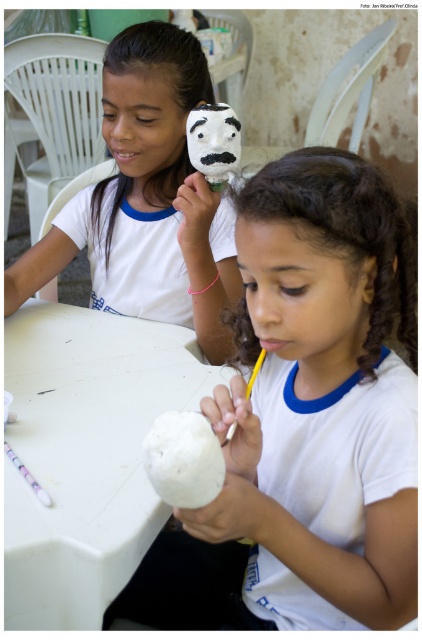
Question: Which object is the closest to the white matte mask at upper center?

Choices:
 (A) white matte egg at center
 (B) white plastic table at center
 (C) white plush toy at upper center
 (D) white matte coconut at center

Answer: (C)

Question: Is white matte mask at upper center below yellow matte pencil at center?

Choices:
 (A) no
 (B) yes

Answer: (A)

Question: Which point is closer to the camera?

Choices:
 (A) white matte coconut at center
 (B) yellow matte pencil at center
 (C) white matte mask at upper center

Answer: (A)

Question: From the image, what is the correct spatial relationship of white matte egg at center in relation to white plush toy at upper center?

Choices:
 (A) right
 (B) left

Answer: (A)

Question: Among these objects, which one is farthest from the camera?

Choices:
 (A) white matte coconut at center
 (B) white plastic table at center
 (C) white matte mask at upper center

Answer: (C)

Question: Is white matte coconut at center thinner than translucent plastic straw at lower left?

Choices:
 (A) yes
 (B) no

Answer: (A)